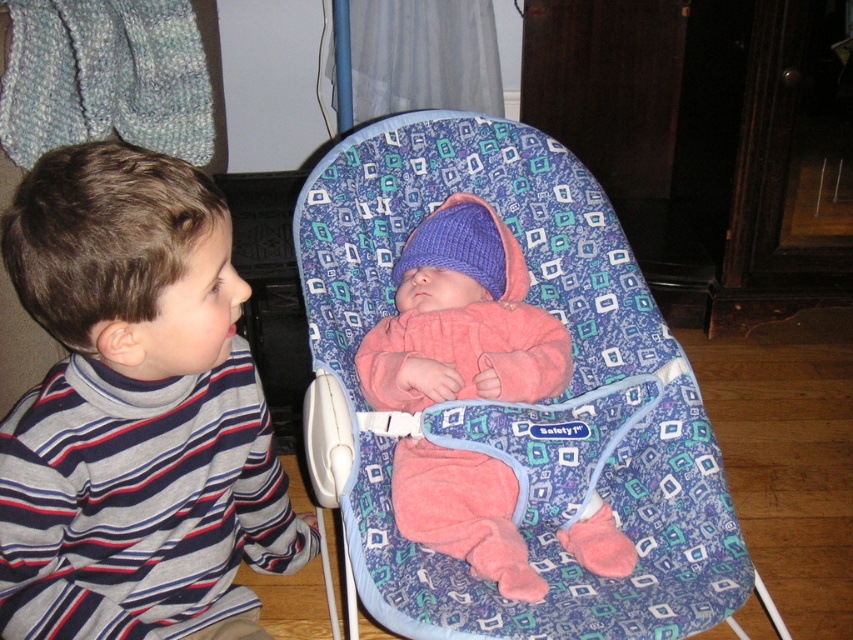
Does blue patterned baby carrier at center appear on the right side of striped turtleneck shirt at left?

Yes, blue patterned baby carrier at center is to the right of striped turtleneck shirt at left.

Does point (648, 380) come farther from viewer compared to point (41, 308)?

Yes, point (648, 380) is behind point (41, 308).

Between point (479, 612) and point (155, 376), which one is positioned in front?

Point (155, 376) is in front.

I want to click on blue patterned baby carrier at center, so click(x=515, y=403).

Does striped turtleneck shirt at left lie behind pink fleece baby at center?

No, striped turtleneck shirt at left is closer to the viewer.

Can you confirm if striped turtleneck shirt at left is shorter than pink fleece baby at center?

No, striped turtleneck shirt at left is not shorter than pink fleece baby at center.

This screenshot has height=640, width=853. Find the location of `striped turtleneck shirt at left`. striped turtleneck shirt at left is located at coordinates (134, 410).

Is blue patterned baby carrier at center closer to camera compared to pink fleece baby at center?

That is True.

Describe the element at coordinates (515, 403) in the screenshot. I see `blue patterned baby carrier at center` at that location.

Locate an element on the screen. The height and width of the screenshot is (640, 853). blue patterned baby carrier at center is located at coordinates (515, 403).